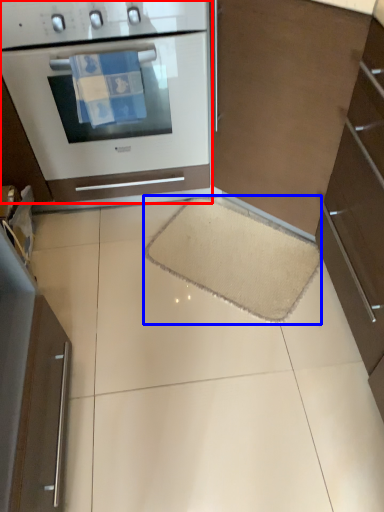
Question: Which object is closer to the camera taking this photo, home appliance (highlighted by a red box) or doormat (highlighted by a blue box)?

Choices:
 (A) home appliance
 (B) doormat

Answer: (A)